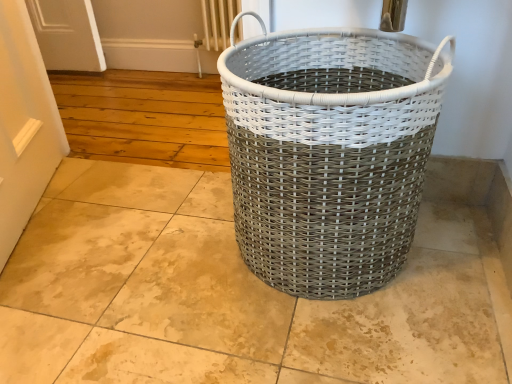
Locate an element on the screen. Image resolution: width=512 pixels, height=384 pixels. free space in front of white woven basket at center is located at coordinates (337, 344).